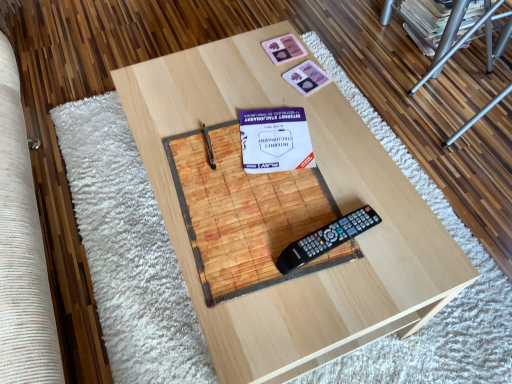
I want to click on vacant area that lies between white paper at center and pink matte playing card at upper center, acting as the 1th square starting from the bottom, so click(x=300, y=112).